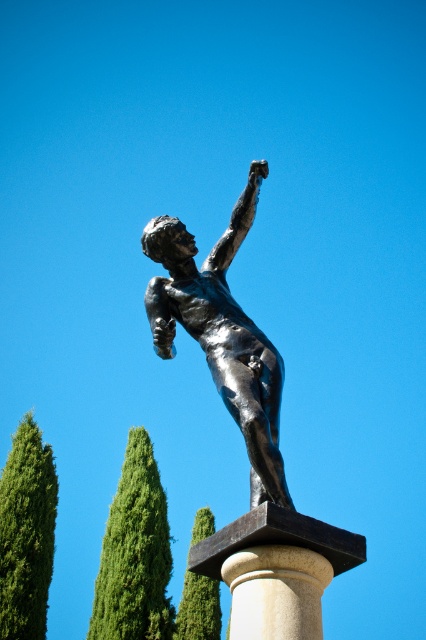
Question: Does green textured tree at left appear over green leafy tree at lower left?

Choices:
 (A) yes
 (B) no

Answer: (A)

Question: Does green textured tree at left appear on the right side of green leafy tree at lower left?

Choices:
 (A) no
 (B) yes

Answer: (A)

Question: Which object is farther from the camera taking this photo?

Choices:
 (A) green leafy tree at center
 (B) green textured tree at left

Answer: (A)

Question: Which point appears farthest from the camera in this image?

Choices:
 (A) (192, 308)
 (B) (164, 531)
 (C) (28, 540)
 (D) (187, 598)

Answer: (D)

Question: Can you confirm if green leafy tree at center is positioned to the right of white marble pillar at center?

Choices:
 (A) no
 (B) yes

Answer: (A)

Question: Which object is closer to the camera taking this photo?

Choices:
 (A) white marble pillar at center
 (B) green leafy tree at center
 (C) shiny bronze statue at center
 (D) green leafy tree at lower left

Answer: (A)